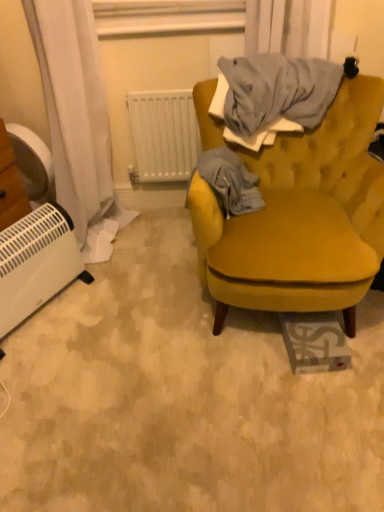
Question: Should I look upward or downward to see white plastic heater at lower left?

Choices:
 (A) down
 (B) up

Answer: (A)

Question: Is velvet mustard yellow armchair at center outside of white plastic radiator at upper center?

Choices:
 (A) no
 (B) yes

Answer: (B)

Question: Could you tell me if velvet mustard yellow armchair at center is turned towards white plastic radiator at upper center?

Choices:
 (A) yes
 (B) no

Answer: (B)

Question: Is velvet mustard yellow armchair at center thinner than white plastic radiator at upper center?

Choices:
 (A) yes
 (B) no

Answer: (B)

Question: Does velvet mustard yellow armchair at center lie in front of white plastic radiator at upper center?

Choices:
 (A) no
 (B) yes

Answer: (B)

Question: Is velvet mustard yellow armchair at center with white plastic radiator at upper center?

Choices:
 (A) no
 (B) yes

Answer: (A)

Question: From the image's perspective, does velvet mustard yellow armchair at center appear lower than white plastic radiator at upper center?

Choices:
 (A) no
 (B) yes

Answer: (B)

Question: Are white plastic heater at lower left and white plastic radiator at upper center making contact?

Choices:
 (A) yes
 (B) no

Answer: (B)

Question: Is white plastic heater at lower left in front of white plastic radiator at upper center?

Choices:
 (A) yes
 (B) no

Answer: (A)

Question: Does white plastic heater at lower left have a smaller size compared to white plastic radiator at upper center?

Choices:
 (A) yes
 (B) no

Answer: (B)

Question: Can you confirm if white plastic heater at lower left is positioned to the right of white plastic radiator at upper center?

Choices:
 (A) yes
 (B) no

Answer: (B)

Question: Does white plastic heater at lower left have a larger size compared to white plastic radiator at upper center?

Choices:
 (A) yes
 (B) no

Answer: (A)

Question: Does white plastic heater at lower left have a lesser height compared to white plastic radiator at upper center?

Choices:
 (A) no
 (B) yes

Answer: (B)

Question: Is white plastic radiator at upper center positioned with its back to white plastic fan at left?

Choices:
 (A) yes
 (B) no

Answer: (B)